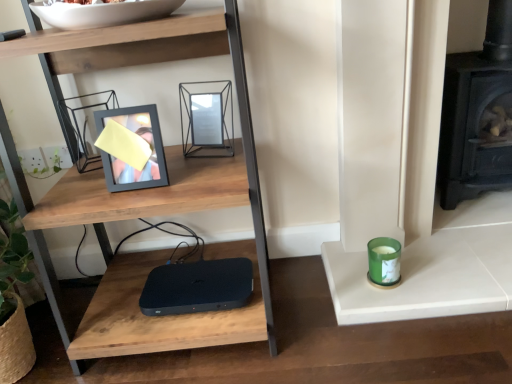
You are a GUI agent. You are given a task and a screenshot of the screen. Output one action in this format:
    pyautogui.click(x=<x>, y=<y>)
    Task: Click on the free space between woodenmaterial/textureshelf at center and green glass candle at right
    This screenshot has width=512, height=384.
    Given the screenshot: What is the action you would take?
    pyautogui.click(x=306, y=304)